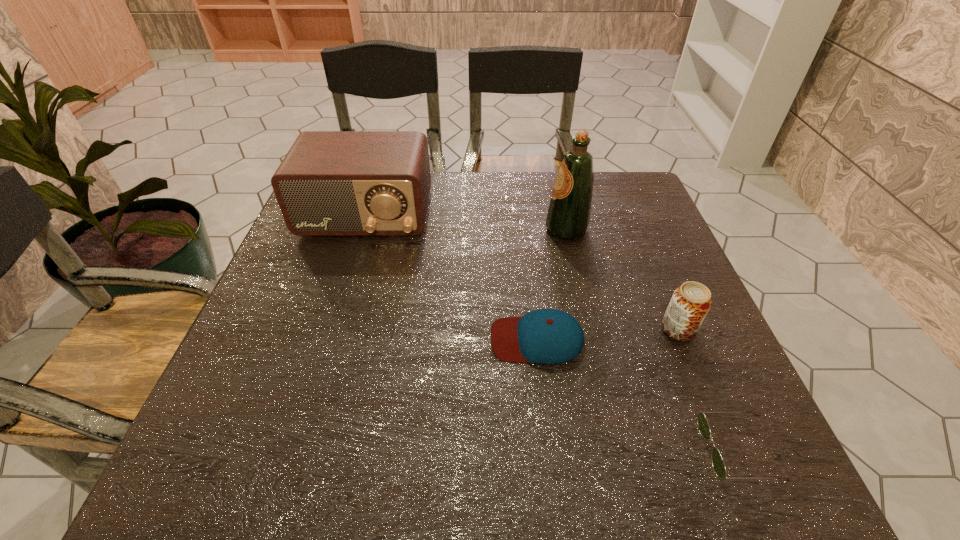
This screenshot has width=960, height=540. I want to click on the tallest object, so click(568, 216).

In order to click on the fourth shortest object in this screenshot , I will do `click(331, 183)`.

Identify the location of radio receiver. (331, 183).

Locate an element on the screen. Image resolution: width=960 pixels, height=540 pixels. beer can is located at coordinates (690, 303).

Find the location of `the fourth tallest object`. the fourth tallest object is located at coordinates click(x=548, y=336).

Where is `sunglasses`? Image resolution: width=960 pixels, height=540 pixels. sunglasses is located at coordinates (718, 464).

Find the location of `the shortest object`. the shortest object is located at coordinates (718, 464).

Where is `free space located on the front-facing side of the tallest object`? The image size is (960, 540). free space located on the front-facing side of the tallest object is located at coordinates (496, 229).

The height and width of the screenshot is (540, 960). Find the location of `vacant space located on the front-facing side of the tallest object`. vacant space located on the front-facing side of the tallest object is located at coordinates (492, 229).

The width and height of the screenshot is (960, 540). I want to click on free space located 0.360m on the front-facing side of the tallest object, so click(x=409, y=229).